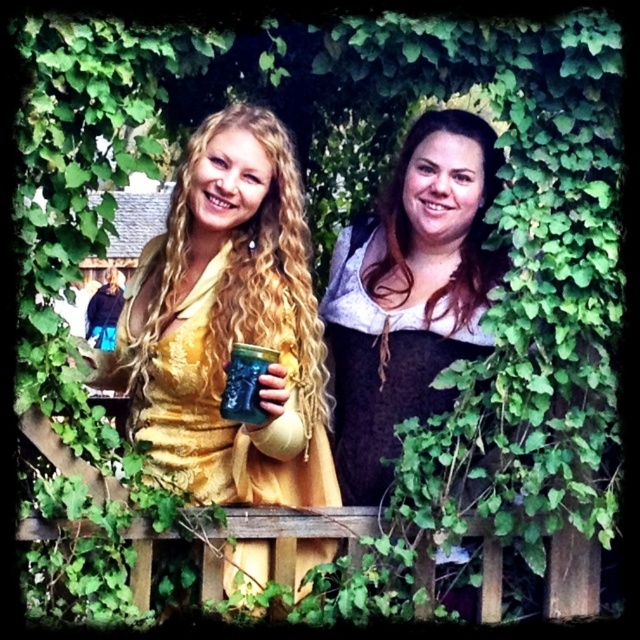
You are a photographer trying to capture a clear shot of the brown matte dress at center and the green glass jar at center. Which object is positioned closer to the camera, making it easier to focus on?

The brown matte dress at center is closer to the camera because the green glass jar at center is behind it, so focusing on the brown matte dress at center would be easier.

In the scene shown: You are a photographer trying to capture the brown matte dress at center in the image. The dress is located at point (468, 225). To ensure the dress is in focus, you need to know its distance from the camera. Can you determine if the brown matte dress at center is closer to the camera than the wooden fence behind which the two individuals are standing?

The brown matte dress at center is located at point (468, 225), which is behind the wooden fence where the two individuals are standing. Therefore, the dress is farther from the camera than the fence, so it would not be in focus if the fence is the primary focus point.